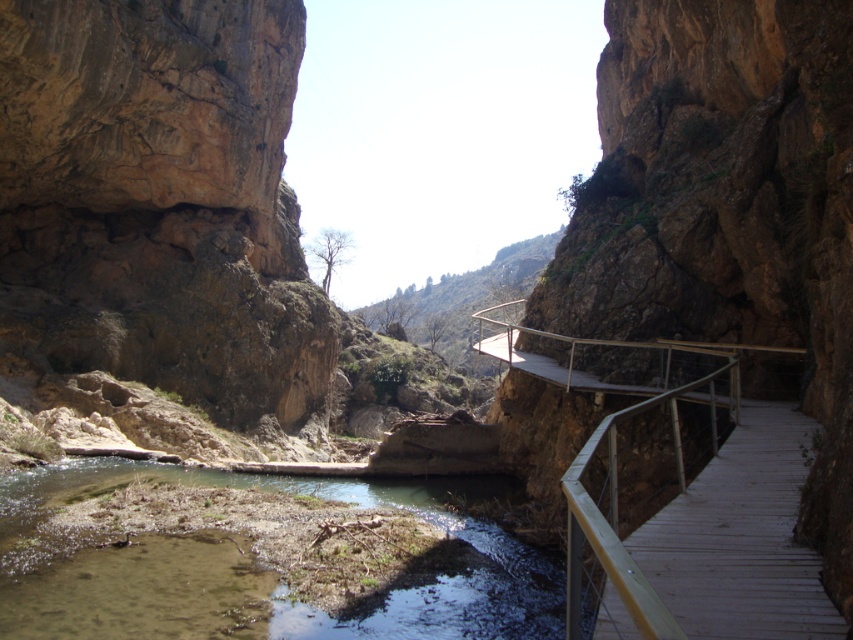
Question: Which of the following is the farthest from the observer?

Choices:
 (A) green mossy river at lower left
 (B) wooden walkway at center

Answer: (A)

Question: Which point is closer to the camera taking this photo?

Choices:
 (A) (670, 604)
 (B) (112, 632)

Answer: (A)

Question: Which point is farther to the camera?

Choices:
 (A) wooden walkway at center
 (B) green mossy river at lower left

Answer: (B)

Question: Can you confirm if green mossy river at lower left is bigger than wooden walkway at center?

Choices:
 (A) no
 (B) yes

Answer: (B)

Question: Is green mossy river at lower left bigger than wooden walkway at center?

Choices:
 (A) no
 (B) yes

Answer: (B)

Question: Is green mossy river at lower left thinner than wooden walkway at center?

Choices:
 (A) yes
 (B) no

Answer: (B)